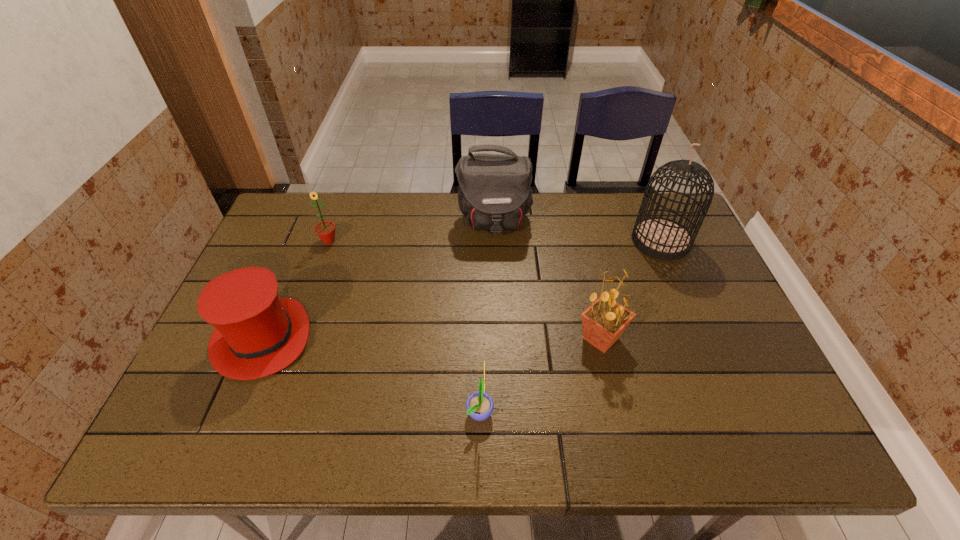
You are a GUI agent. You are given a task and a screenshot of the screen. Output one action in this format:
    pyautogui.click(x=<x>, y=<y>)
    Task: Click on the tallest object
    The image size is (960, 540).
    Given the screenshot: What is the action you would take?
    [661, 238]

Where is `the rightmost object`? This screenshot has height=540, width=960. the rightmost object is located at coordinates (661, 238).

Where is `shoulder bag`? Image resolution: width=960 pixels, height=540 pixels. shoulder bag is located at coordinates (494, 193).

Where is `the rightmost sunflower`? The height and width of the screenshot is (540, 960). the rightmost sunflower is located at coordinates (603, 322).

This screenshot has height=540, width=960. Identify the location of the tallest sunflower. (603, 322).

Locate an element on the screen. The image size is (960, 540). the leftmost sunflower is located at coordinates (325, 230).

I want to click on the second sunflower from left to right, so click(479, 405).

I want to click on the nearest object, so click(x=479, y=405).

I want to click on hat, so click(x=256, y=334).

Locate an element on the screen. free location located 0.110m on the back of the birdcage is located at coordinates (644, 202).